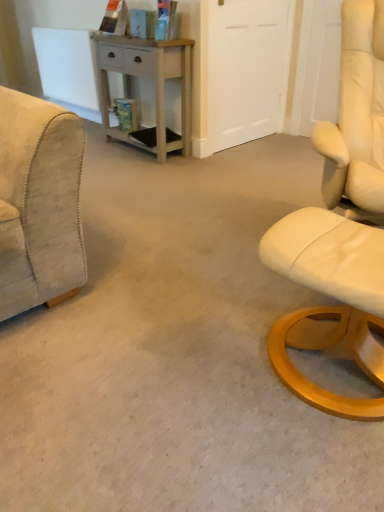
Question: Is light gray wood desk at center wider than beige corduroy armchair at left?

Choices:
 (A) no
 (B) yes

Answer: (A)

Question: Can you confirm if light gray wood desk at center is taller than beige corduroy armchair at left?

Choices:
 (A) yes
 (B) no

Answer: (B)

Question: Is there a large distance between light gray wood desk at center and beige corduroy armchair at left?

Choices:
 (A) yes
 (B) no

Answer: (A)

Question: Is the depth of light gray wood desk at center less than that of beige corduroy armchair at left?

Choices:
 (A) yes
 (B) no

Answer: (B)

Question: Is light gray wood desk at center next to beige corduroy armchair at left and touching it?

Choices:
 (A) yes
 (B) no

Answer: (B)

Question: Is light gray wood desk at center bigger or smaller than white matte door at upper center?

Choices:
 (A) big
 (B) small

Answer: (A)

Question: Is point (x=158, y=71) positioned closer to the camera than point (x=213, y=111)?

Choices:
 (A) closer
 (B) farther

Answer: (A)

Question: Is light gray wood desk at center inside or outside of white matte door at upper center?

Choices:
 (A) inside
 (B) outside

Answer: (B)

Question: From a real-world perspective, is light gray wood desk at center physically located above or below white matte door at upper center?

Choices:
 (A) above
 (B) below

Answer: (B)

Question: Considering the positions of white matte door at upper center and beige corduroy armchair at left in the image, is white matte door at upper center taller or shorter than beige corduroy armchair at left?

Choices:
 (A) short
 (B) tall

Answer: (B)

Question: Considering the positions of white matte door at upper center and beige corduroy armchair at left in the image, is white matte door at upper center bigger or smaller than beige corduroy armchair at left?

Choices:
 (A) small
 (B) big

Answer: (A)

Question: From a real-world perspective, is white matte door at upper center positioned above or below beige corduroy armchair at left?

Choices:
 (A) below
 (B) above

Answer: (A)

Question: Is point (251, 126) closer or farther from the camera than point (18, 198)?

Choices:
 (A) closer
 (B) farther

Answer: (B)

Question: From a real-world perspective, is beige corduroy armchair at left positioned above or below light gray wood desk at center?

Choices:
 (A) below
 (B) above

Answer: (B)

Question: In terms of height, does beige corduroy armchair at left look taller or shorter compared to light gray wood desk at center?

Choices:
 (A) tall
 (B) short

Answer: (A)